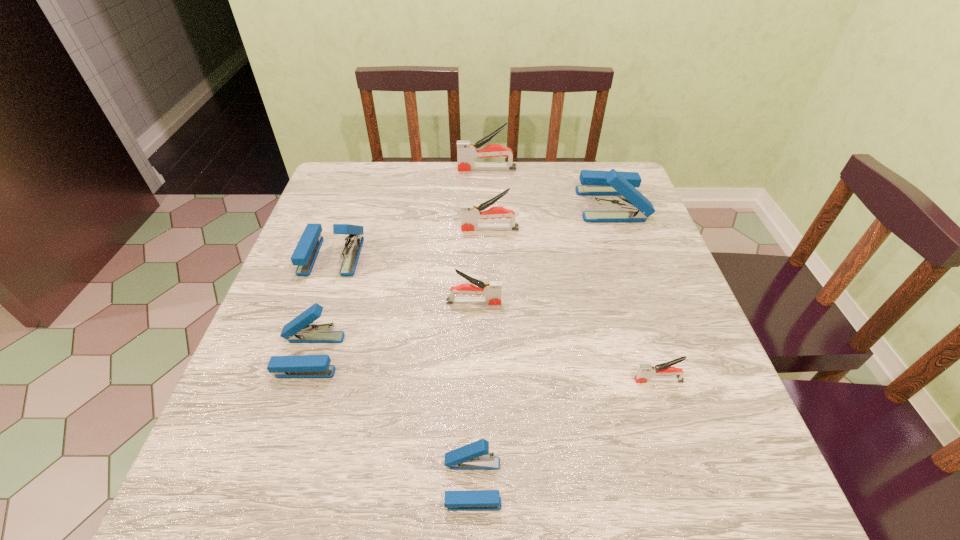
I want to click on the third farthest blue stapler, so click(298, 330).

Locate an element on the screen. the nearest gray stapler is located at coordinates (646, 373).

Identify the location of the rightmost gray stapler. (646, 373).

Locate an element on the screen. Image resolution: width=960 pixels, height=540 pixels. the nearest blue stapler is located at coordinates (475, 456).

What are the coordinates of `the second blue stapler from right to left` in the screenshot? It's located at (475, 456).

Where is `free space located on the handle side of the farthest gray stapler`? free space located on the handle side of the farthest gray stapler is located at coordinates coord(439,169).

Identify the location of vacant space located 0.190m on the handle side of the farthest gray stapler. (396, 169).

You are a GUI agent. You are given a task and a screenshot of the screen. Output one action in this format:
    pyautogui.click(x=<x>, y=<y>)
    Task: Click on the vacant region located on the handle side of the farthest gray stapler
    The image size is (960, 540).
    Given the screenshot: What is the action you would take?
    pyautogui.click(x=367, y=169)

Where is `free space located 0.350m on the left of the seventh nearest stapler`? The image size is (960, 540). free space located 0.350m on the left of the seventh nearest stapler is located at coordinates 453,205.

Locate an element on the screen. The width and height of the screenshot is (960, 540). vacant area situated 0.170m on the handle side of the second farthest gray stapler is located at coordinates (396, 229).